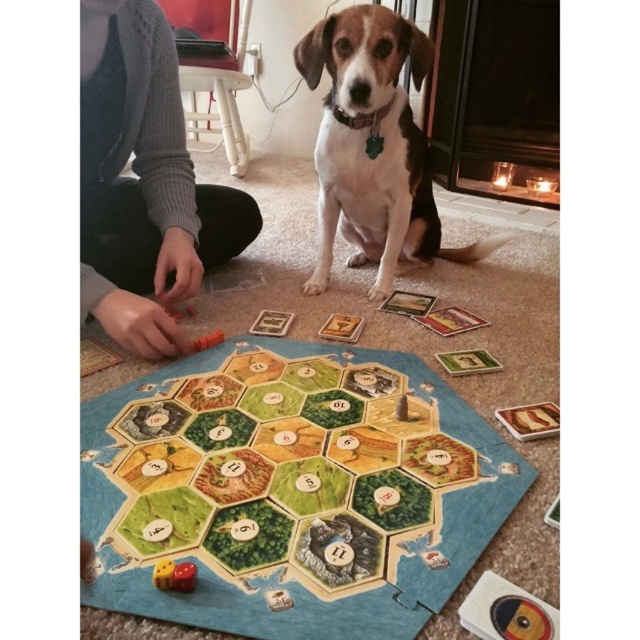
Question: Is wooden hexagonal tiles at center thinner than brown and white fur dog at center?

Choices:
 (A) yes
 (B) no

Answer: (B)

Question: Does wooden hexagonal tiles at center have a greater width compared to brown and white fur dog at center?

Choices:
 (A) yes
 (B) no

Answer: (A)

Question: Which of the following is the closest to the observer?

Choices:
 (A) (202, 483)
 (B) (392, 172)

Answer: (A)

Question: Among these points, which one is farthest from the camera?

Choices:
 (A) (291, 628)
 (B) (353, 236)

Answer: (B)

Question: Is wooden hexagonal tiles at center to the right of brown and white fur dog at center from the viewer's perspective?

Choices:
 (A) yes
 (B) no

Answer: (B)

Question: Which point appears farthest from the camera in this image?

Choices:
 (A) (321, 579)
 (B) (326, 104)

Answer: (B)